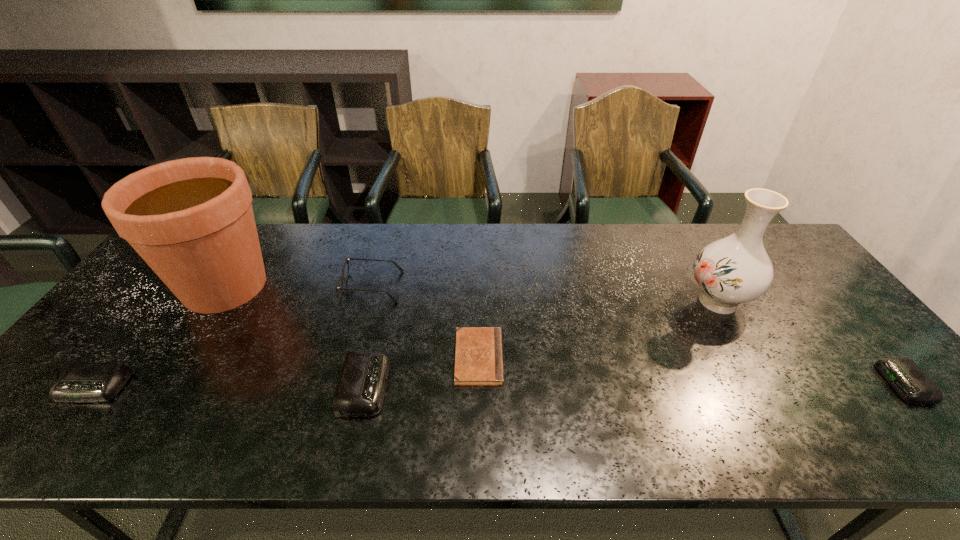
This screenshot has width=960, height=540. What are the coordinates of `free region located on the display of the second alarm clock from left to right` in the screenshot? It's located at (492, 386).

Where is `vacant space located 0.190m on the display of the sixth tallest object`? Image resolution: width=960 pixels, height=540 pixels. vacant space located 0.190m on the display of the sixth tallest object is located at coordinates (807, 383).

You are a GUI agent. You are given a task and a screenshot of the screen. Output one action in this format:
    pyautogui.click(x=<x>, y=<y>)
    Task: Click on the free space located 0.320m on the display of the sixth tallest object
    
    Given the screenshot: What is the action you would take?
    pyautogui.click(x=753, y=383)

Find the location of a particular element. Image resolution: width=960 pixels, height=540 pixels. vacant space located 0.050m on the display of the sixth tallest object is located at coordinates (866, 383).

This screenshot has height=540, width=960. I want to click on vacant position located 0.180m on the right of the flowerpot, so click(x=339, y=286).

Where is `free region located with the lenses facing outward on the fifth shortest object`? The image size is (960, 540). free region located with the lenses facing outward on the fifth shortest object is located at coordinates (452, 287).

At what (x,y) coordinates should I click in order to perform the action: click on blank space located on the left of the second object from right to left. Please return your answer as a coordinate pair (x, y). The height and width of the screenshot is (540, 960). Looking at the image, I should click on (632, 301).

The width and height of the screenshot is (960, 540). I want to click on vacant space located 0.390m on the spine side of the third object from right to left, so click(658, 357).

Identify the location of object positioned at the far edge. The height and width of the screenshot is (540, 960). (191, 220).

This screenshot has width=960, height=540. Find the location of `diary that is positioned at the near edge`. diary that is positioned at the near edge is located at coordinates (478, 359).